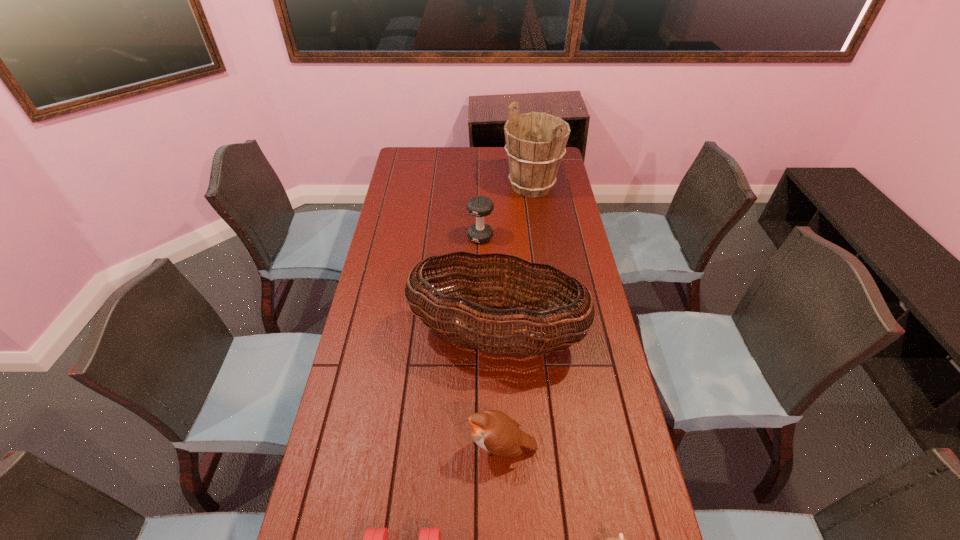
At what (x,y) coordinates should I click in order to perform the action: click on free location located 0.110m at the face of the fourth farthest object. Please return your answer as a coordinate pair (x, y). Looking at the image, I should click on (422, 447).

You are a GUI agent. You are given a task and a screenshot of the screen. Output one action in this format:
    pyautogui.click(x=<x>, y=<y>)
    Task: Click on the free spot located 0.320m at the face of the fourth farthest object
    
    Given the screenshot: What is the action you would take?
    pyautogui.click(x=342, y=447)

The height and width of the screenshot is (540, 960). I want to click on vacant position located 0.350m at the face of the fourth farthest object, so click(330, 447).

Find the location of `object present at the far edge`. object present at the far edge is located at coordinates pos(535,142).

The image size is (960, 540). I want to click on bucket positioned at the right edge, so click(535, 142).

Find the location of a particular element. basket that is positioned at the right edge is located at coordinates (506, 335).

You are a GUI agent. You are given a task and a screenshot of the screen. Output one action in this format:
    pyautogui.click(x=<x>, y=<y>)
    Task: Click on the object located at the far right corner
    
    Given the screenshot: What is the action you would take?
    pyautogui.click(x=535, y=142)

Locate an element on the screen. The width and height of the screenshot is (960, 540). free location at the far edge of the desktop is located at coordinates (505, 156).

This screenshot has height=540, width=960. In order to click on vacant region at the left edge of the desktop in this screenshot , I will do `click(339, 512)`.

Locate an element on the screen. The height and width of the screenshot is (540, 960). vacant area at the right edge of the desktop is located at coordinates (558, 266).